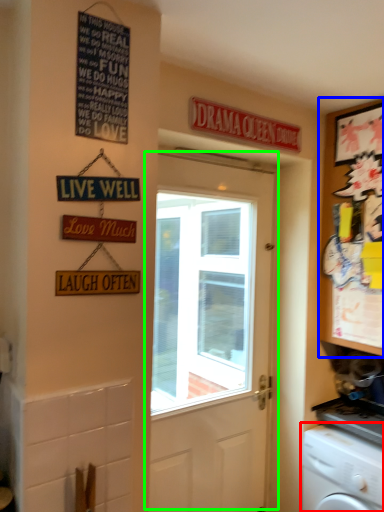
Question: Based on their relative distances, which object is farther from washing machine (highlighted by a red box)? Choose from cabinetry (highlighted by a blue box) and door (highlighted by a green box).

Choices:
 (A) cabinetry
 (B) door

Answer: (B)